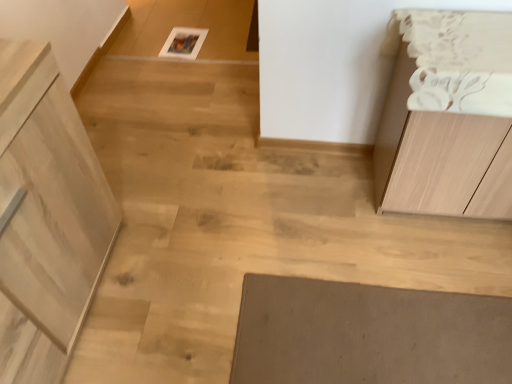
Measure the distance between point (478, 143) and camera.

Point (478, 143) is 4.01 feet from camera.

In order to face light wood cabinet at right, positioned as the second cabinetry in left-to-right order, should I rotate leftwards or rightwards?

You should look right and rotate roughly 27.065 degrees.

This screenshot has width=512, height=384. What do you see at coordinates (447, 116) in the screenshot?
I see `light wood cabinet at right, positioned as the second cabinetry in left-to-right order` at bounding box center [447, 116].

Image resolution: width=512 pixels, height=384 pixels. In order to click on light wood cabinet at right, the 1th cabinetry in the right-to-left sequence in this screenshot , I will do `click(447, 116)`.

You are a GUI agent. You are given a task and a screenshot of the screen. Output one action in this format:
    pyautogui.click(x=<x>, y=<y>)
    Task: Click on the light wood cabinet at left, the second cabinetry from the right
    
    Given the screenshot: What is the action you would take?
    click(46, 216)

Measure the distance between light wood cabinet at left, which is the 1th cabinetry from left to right, and camera.

light wood cabinet at left, which is the 1th cabinetry from left to right, is 34.03 inches away from camera.

The height and width of the screenshot is (384, 512). What do you see at coordinates (46, 216) in the screenshot? I see `light wood cabinet at left, the second cabinetry from the right` at bounding box center [46, 216].

This screenshot has width=512, height=384. I want to click on light wood cabinet at right, positioned as the second cabinetry in left-to-right order, so click(447, 116).

Does light wood cabinet at right, the 1th cabinetry in the right-to-left sequence, appear on the left side of light wood cabinet at left, the second cabinetry from the right?

No, light wood cabinet at right, the 1th cabinetry in the right-to-left sequence, is not to the left of light wood cabinet at left, the second cabinetry from the right.

Who is more distant, light wood cabinet at right, the 1th cabinetry in the right-to-left sequence, or light wood cabinet at left, which is the 1th cabinetry from left to right?

light wood cabinet at right, the 1th cabinetry in the right-to-left sequence, is behind.

Does point (468, 20) lie behind point (53, 223)?

That is True.

Consider the image. From the image's perspective, who appears lower, light wood cabinet at right, the 1th cabinetry in the right-to-left sequence, or light wood cabinet at left, which is the 1th cabinetry from left to right?

light wood cabinet at left, which is the 1th cabinetry from left to right.

From a real-world perspective, which is physically above, light wood cabinet at right, the 1th cabinetry in the right-to-left sequence, or light wood cabinet at left, which is the 1th cabinetry from left to right?

light wood cabinet at left, which is the 1th cabinetry from left to right.

Which object is wider, light wood cabinet at right, positioned as the second cabinetry in left-to-right order, or light wood cabinet at left, which is the 1th cabinetry from left to right?

Wider between the two is light wood cabinet at left, which is the 1th cabinetry from left to right.

Consider the image. Is light wood cabinet at right, positioned as the second cabinetry in left-to-right order, taller or shorter than light wood cabinet at left, the second cabinetry from the right?

Considering their sizes, light wood cabinet at right, positioned as the second cabinetry in left-to-right order, has less height than light wood cabinet at left, the second cabinetry from the right.

Is light wood cabinet at right, the 1th cabinetry in the right-to-left sequence, smaller than light wood cabinet at left, which is the 1th cabinetry from left to right?

Indeed, light wood cabinet at right, the 1th cabinetry in the right-to-left sequence, has a smaller size compared to light wood cabinet at left, which is the 1th cabinetry from left to right.

Is light wood cabinet at right, positioned as the second cabinetry in left-to-right order, not within light wood cabinet at left, the second cabinetry from the right?

Yes.

Are light wood cabinet at right, positioned as the second cabinetry in left-to-right order, and light wood cabinet at left, which is the 1th cabinetry from left to right, beside each other?

light wood cabinet at right, positioned as the second cabinetry in left-to-right order, and light wood cabinet at left, which is the 1th cabinetry from left to right, are not in contact.

Is light wood cabinet at left, which is the 1th cabinetry from left to right, at the back of light wood cabinet at right, the 1th cabinetry in the right-to-left sequence?

No, light wood cabinet at right, the 1th cabinetry in the right-to-left sequence, is not facing away from light wood cabinet at left, which is the 1th cabinetry from left to right.

Consider the image. Measure the distance from light wood cabinet at right, the 1th cabinetry in the right-to-left sequence, to light wood cabinet at left, which is the 1th cabinetry from left to right.

light wood cabinet at right, the 1th cabinetry in the right-to-left sequence, is 1.04 meters away from light wood cabinet at left, which is the 1th cabinetry from left to right.

Identify the location of cabinetry lying in front of the light wood cabinet at right, the 1th cabinetry in the right-to-left sequence. Image resolution: width=512 pixels, height=384 pixels. (46, 216).

Based on the photo, considering the relative positions of light wood cabinet at left, the second cabinetry from the right, and light wood cabinet at right, the 1th cabinetry in the right-to-left sequence, in the image provided, is light wood cabinet at left, the second cabinetry from the right, to the left or to the right of light wood cabinet at right, the 1th cabinetry in the right-to-left sequence,?

In the image, light wood cabinet at left, the second cabinetry from the right, appears on the left side of light wood cabinet at right, the 1th cabinetry in the right-to-left sequence.

Does light wood cabinet at left, which is the 1th cabinetry from left to right, come behind light wood cabinet at right, positioned as the second cabinetry in left-to-right order?

No, the depth of light wood cabinet at left, which is the 1th cabinetry from left to right, is less than that of light wood cabinet at right, positioned as the second cabinetry in left-to-right order.

Is point (20, 108) positioned after point (471, 195)?

No, it is not.

From the image's perspective, between light wood cabinet at left, the second cabinetry from the right, and light wood cabinet at right, the 1th cabinetry in the right-to-left sequence, who is located below?

light wood cabinet at left, the second cabinetry from the right, from the image's perspective.

From a real-world perspective, between light wood cabinet at left, which is the 1th cabinetry from left to right, and light wood cabinet at right, positioned as the second cabinetry in left-to-right order, who is vertically lower?

From a 3D spatial view, light wood cabinet at right, positioned as the second cabinetry in left-to-right order, is below.

Is light wood cabinet at left, the second cabinetry from the right, wider than light wood cabinet at right, positioned as the second cabinetry in left-to-right order?

Indeed, light wood cabinet at left, the second cabinetry from the right, has a greater width compared to light wood cabinet at right, positioned as the second cabinetry in left-to-right order.

Is light wood cabinet at left, which is the 1th cabinetry from left to right, taller than light wood cabinet at right, positioned as the second cabinetry in left-to-right order?

Correct, light wood cabinet at left, which is the 1th cabinetry from left to right, is much taller as light wood cabinet at right, positioned as the second cabinetry in left-to-right order.

Considering the sizes of objects light wood cabinet at left, the second cabinetry from the right, and light wood cabinet at right, positioned as the second cabinetry in left-to-right order, in the image provided, who is smaller, light wood cabinet at left, the second cabinetry from the right, or light wood cabinet at right, positioned as the second cabinetry in left-to-right order,?

light wood cabinet at right, positioned as the second cabinetry in left-to-right order, is smaller.

Looking at this image, would you say light wood cabinet at left, which is the 1th cabinetry from left to right, contains light wood cabinet at right, positioned as the second cabinetry in left-to-right order?

No.

Is light wood cabinet at left, the second cabinetry from the right, far from light wood cabinet at right, positioned as the second cabinetry in left-to-right order?

Yes.

Could you tell me if light wood cabinet at left, the second cabinetry from the right, is facing light wood cabinet at right, positioned as the second cabinetry in left-to-right order?

Yes, light wood cabinet at left, the second cabinetry from the right, is aimed at light wood cabinet at right, positioned as the second cabinetry in left-to-right order.

What's the angular difference between light wood cabinet at left, the second cabinetry from the right, and light wood cabinet at right, positioned as the second cabinetry in left-to-right order,'s facing directions?

There is a 92.4-degree angle between the facing directions of light wood cabinet at left, the second cabinetry from the right, and light wood cabinet at right, positioned as the second cabinetry in left-to-right order.

Where is `cabinetry located behind the light wood cabinet at left, which is the 1th cabinetry from left to right`? The width and height of the screenshot is (512, 384). cabinetry located behind the light wood cabinet at left, which is the 1th cabinetry from left to right is located at coordinates (447, 116).

I want to click on cabinetry on the right of light wood cabinet at left, which is the 1th cabinetry from left to right, so click(x=447, y=116).

Image resolution: width=512 pixels, height=384 pixels. I want to click on cabinetry that is on the left side of light wood cabinet at right, the 1th cabinetry in the right-to-left sequence, so click(46, 216).